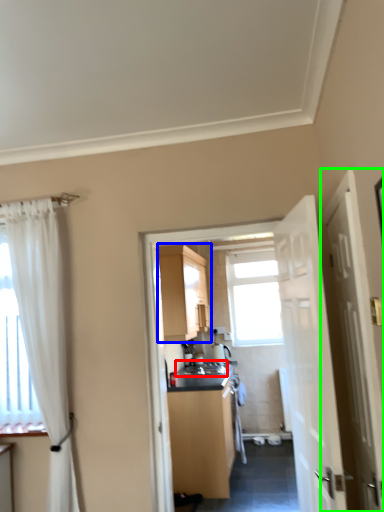
Question: Estimate the real-world distances between objects in this image. Which object is closer to sink (highlighted by a red box), cabinetry (highlighted by a blue box) or door (highlighted by a green box)?

Choices:
 (A) cabinetry
 (B) door

Answer: (A)